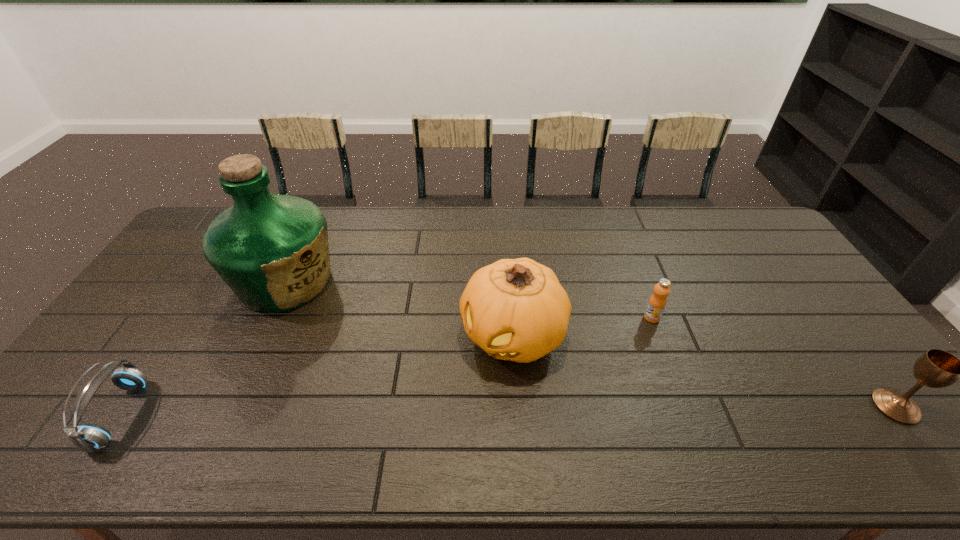
Where is `object situated at the left edge`? Image resolution: width=960 pixels, height=540 pixels. object situated at the left edge is located at coordinates (87, 437).

The height and width of the screenshot is (540, 960). Find the location of `object at the right edge`. object at the right edge is located at coordinates (936, 368).

Locate an element on the screen. object that is at the near left corner is located at coordinates (87, 437).

Where is `object at the near right corner`? object at the near right corner is located at coordinates (936, 368).

In the image, there is a desktop. At what (x,y) coordinates should I click in order to perform the action: click on vacant space at the far edge. Please return your answer as a coordinate pair (x, y). This screenshot has height=540, width=960. Looking at the image, I should click on (651, 230).

This screenshot has height=540, width=960. In the image, there is a desktop. Identify the location of vacant region at the near edge. (353, 417).

Locate an element on the screen. vacant area at the left edge is located at coordinates (175, 322).

In order to click on vacant space that's between the liquor and the third tallest object in this screenshot , I will do `click(590, 344)`.

The width and height of the screenshot is (960, 540). What are the coordinates of `vacant space that is in between the leftmost object and the fourth object from left to right` in the screenshot? It's located at (386, 366).

This screenshot has height=540, width=960. In order to click on free point between the orange juice and the rightmost object in this screenshot , I will do `click(774, 362)`.